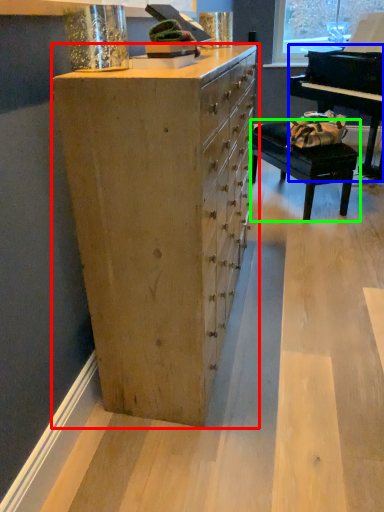
Question: Which object is the closest to the chest of drawers (highlighted by a red box)? Choose among these: piano (highlighted by a blue box) or table (highlighted by a green box).

Choices:
 (A) piano
 (B) table

Answer: (A)